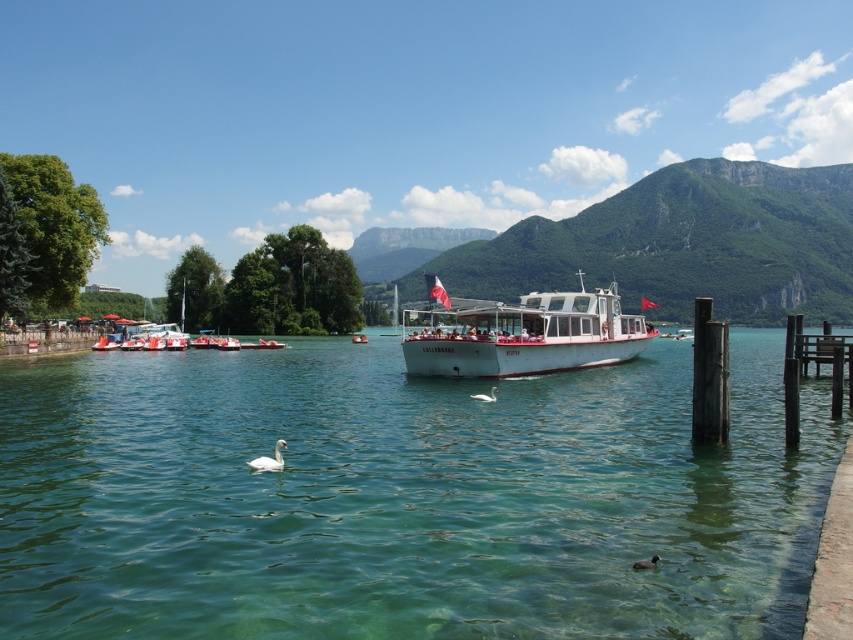
How much distance is there between clear water at center and white glossy swan at lower center?

clear water at center and white glossy swan at lower center are 18.96 meters apart.

From the picture: How distant is clear water at center from white glossy swan at lower center?

clear water at center and white glossy swan at lower center are 18.96 meters apart from each other.

Which is behind, point (379, 509) or point (276, 451)?

Point (276, 451)

The width and height of the screenshot is (853, 640). In order to click on clear water at center in this screenshot , I will do [402, 497].

Is point (532, 307) positioned before point (250, 467)?

No, it is not.

Describe the element at coordinates (525, 336) in the screenshot. I see `white matte boat at center` at that location.

Is point (589, 326) farther from camera compared to point (254, 465)?

Yes, it is behind point (254, 465).

The width and height of the screenshot is (853, 640). Find the location of `white matte boat at center`. white matte boat at center is located at coordinates (525, 336).

Is point (769, 164) positioned after point (436, 337)?

Yes, it is.

Between green rocky mountain at upper center and white matte boat at center, which one has less height?

With less height is white matte boat at center.

Who is more distant from viewer, (552, 260) or (561, 321)?

The point (552, 260) is behind.

I want to click on green rocky mountain at upper center, so click(x=682, y=244).